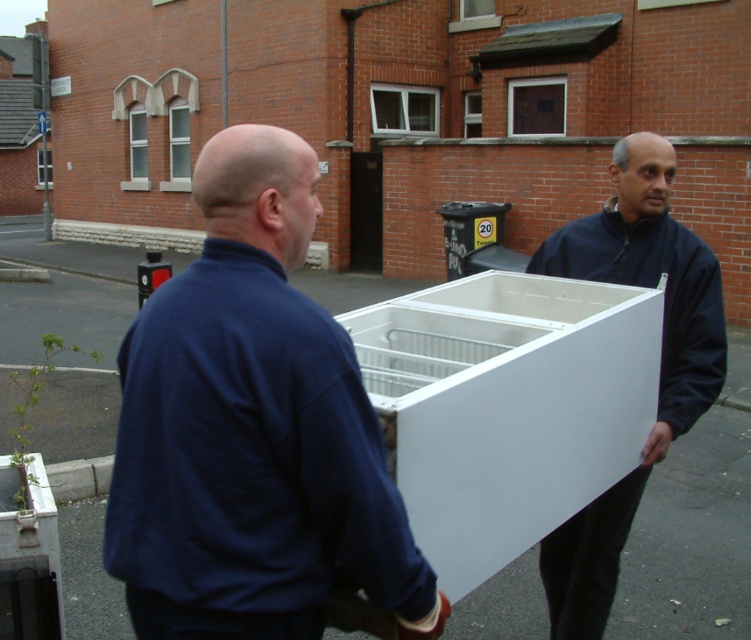
Which is in front, point (308, 593) or point (587, 244)?

Point (308, 593) is in front.

Is blue fabric jacket at center below matte white cabinet at right?

No, blue fabric jacket at center is not below matte white cabinet at right.

Does point (115, 525) lie behind point (605, 595)?

No, (115, 525) is in front of (605, 595).

Image resolution: width=751 pixels, height=640 pixels. I want to click on blue fabric jacket at center, so click(x=252, y=429).